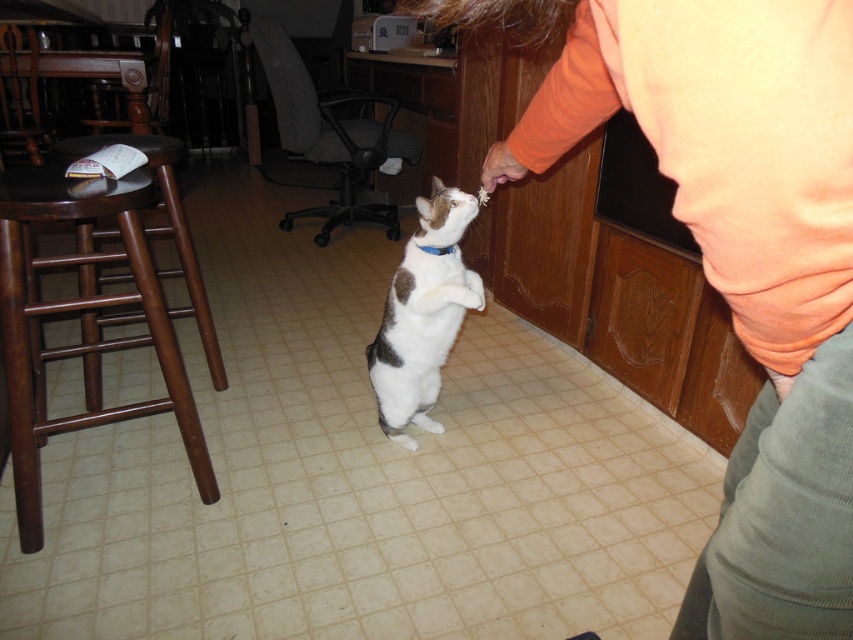
You are a delivery robot in the kitchen. You need to move from your current position to the door on the other side of the room. There is a cat standing on its hind legs at point (9, 369). The distance between you and the cat is 1.37 meters. Can you safely navigate around the cat without getting too close?

The distance between you and the cat at point (9, 369) is 1.37 meters. Since the minimum safe distance for navigation is typically more than 1 meter, you can safely navigate around the cat as the distance is sufficient.

You are a cat owner trying to locate your cat. You see the orange cotton shirt at upper right and the brown wood bar stool at left. Which object is higher in the image?

The orange cotton shirt at upper right is located above the brown wood bar stool at left, so it is higher in the image.